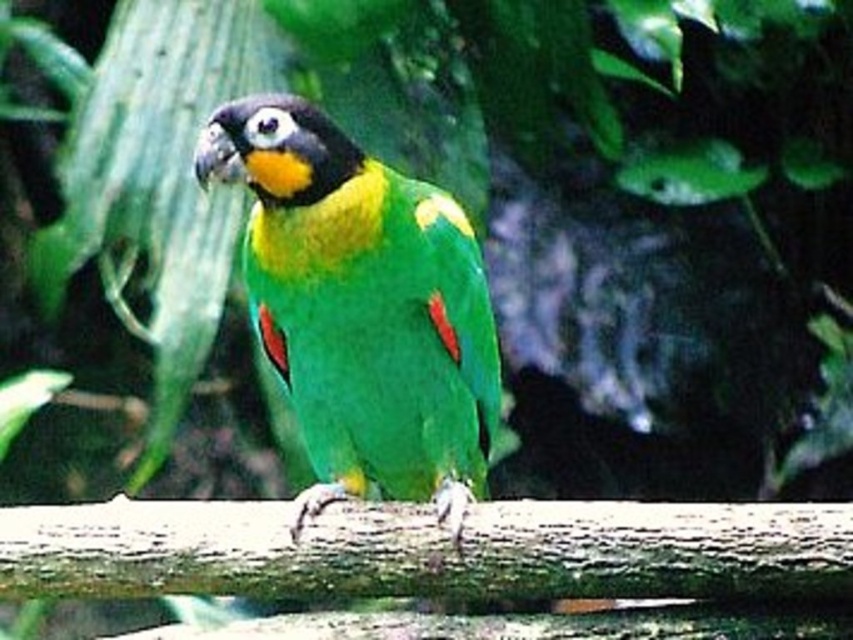
Question: Among these objects, which one is nearest to the camera?

Choices:
 (A) brown rough branch at center
 (B) green matte parrot at center

Answer: (A)

Question: Does green matte parrot at center have a greater width compared to brown rough branch at center?

Choices:
 (A) yes
 (B) no

Answer: (B)

Question: From the image, what is the correct spatial relationship of green matte parrot at center in relation to brown rough branch at center?

Choices:
 (A) right
 (B) left

Answer: (B)

Question: Which object appears farthest from the camera in this image?

Choices:
 (A) green matte parrot at center
 (B) brown rough branch at center

Answer: (A)

Question: Where is green matte parrot at center located in relation to brown rough branch at center in the image?

Choices:
 (A) right
 (B) left

Answer: (B)